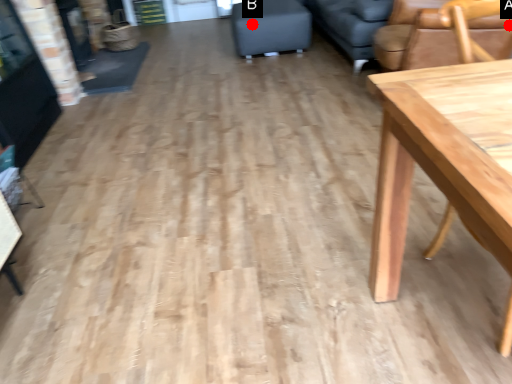
Question: Two points are circled on the image, labeled by A and B beside each circle. Among these points, which one is farthest from the camera?

Choices:
 (A) A is further
 (B) B is further

Answer: (B)